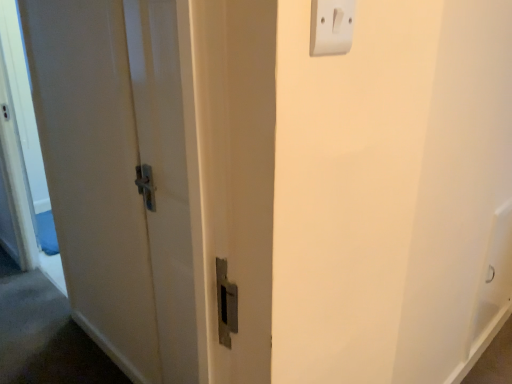
In order to face white plastic light switch at upper right, should I rotate leftwards or rightwards?

To align with it, rotate right about 11.038°.

Measure the distance between point [325,19] and camera.

Point [325,19] is 57.30 centimeters from camera.

What do you see at coordinates (331, 27) in the screenshot? I see `white plastic light switch at upper right` at bounding box center [331, 27].

This screenshot has height=384, width=512. In order to click on white plastic light switch at upper right in this screenshot , I will do `click(331, 27)`.

At what (x,y) coordinates should I click in order to perform the action: click on white plastic light switch at upper right. Please return your answer as a coordinate pair (x, y). This screenshot has height=384, width=512. Looking at the image, I should click on [x=331, y=27].